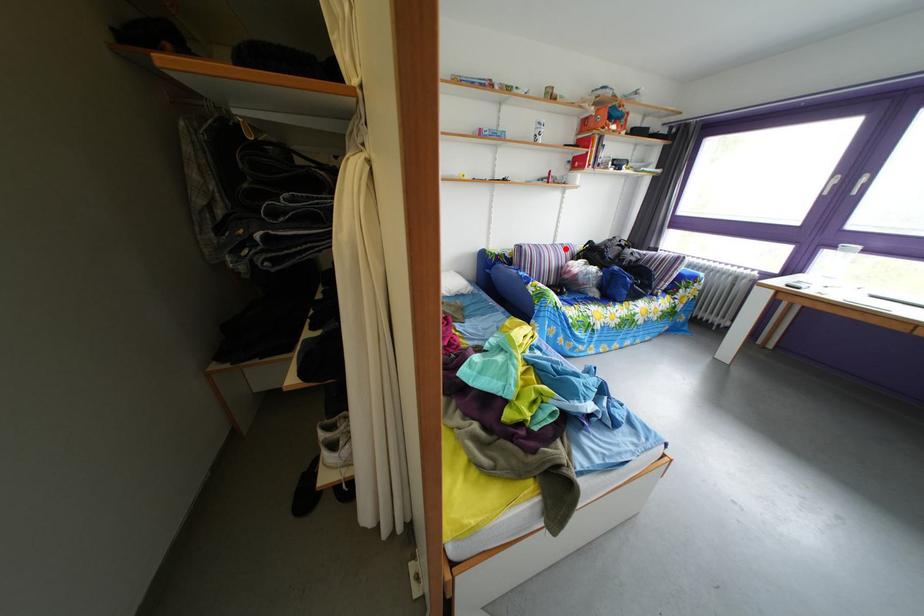
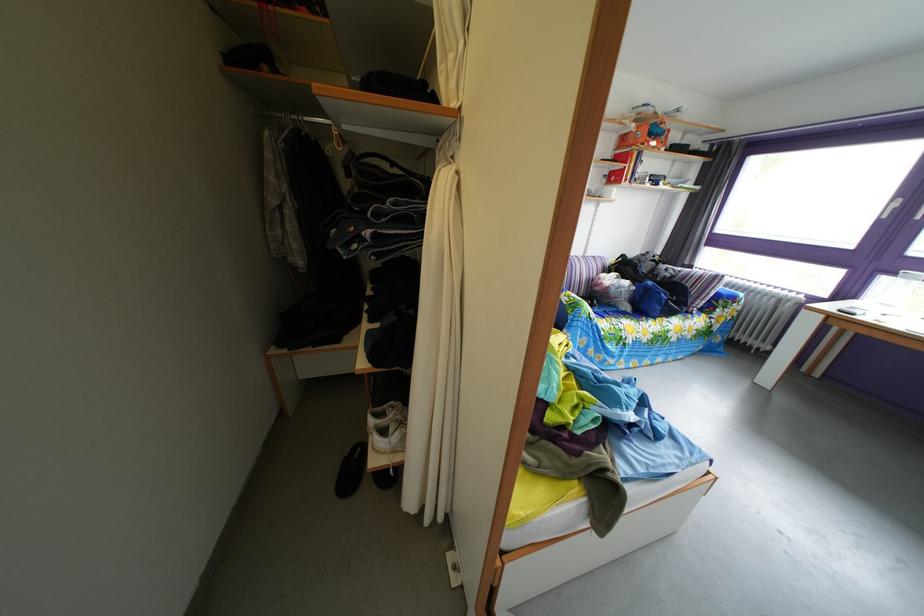
Find the pixel in the second image that matches the highlighted location in the first image.

(596, 261)